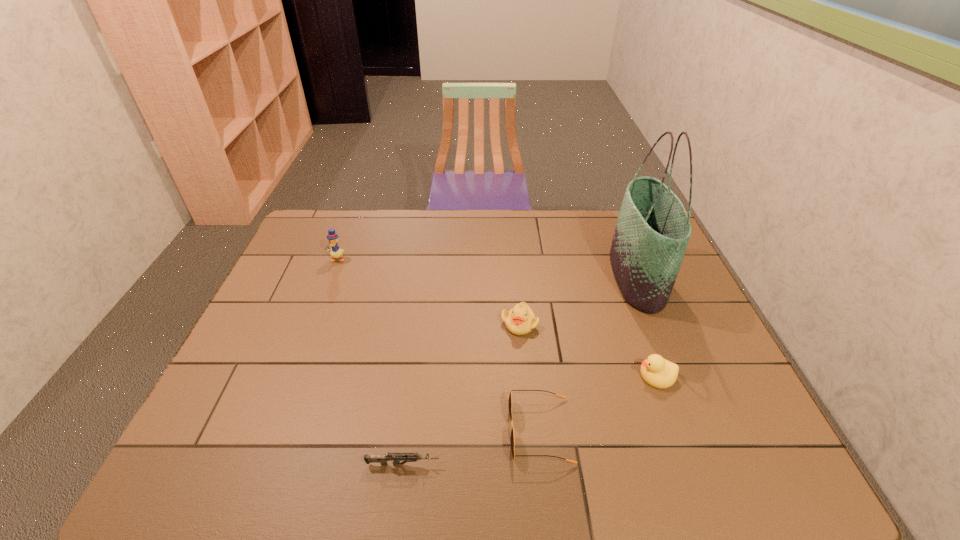
Image resolution: width=960 pixels, height=540 pixels. Find the location of `vacant region between the second duckling from right to left and the shortest object`. vacant region between the second duckling from right to left and the shortest object is located at coordinates (462, 394).

Locate which object ranks fifth in proximity to the rightmost duckling. Please provide its 2D coordinates. Your answer should be formatted as a tuple, i.e. [(x, y)], where the tuple contains the x and y coordinates of a point satisfying the conditions above.

[(335, 252)]

Identify which object is the fourth closest to the tote bag. Please provide its 2D coordinates. Your answer should be formatted as a tuple, i.e. [(x, y)], where the tuple contains the x and y coordinates of a point satisfying the conditions above.

[(395, 457)]

Choose which duckling is the second nearest neighbor to the leftmost duckling. Please provide its 2D coordinates. Your answer should be formatted as a tuple, i.e. [(x, y)], where the tuple contains the x and y coordinates of a point satisfying the conditions above.

[(656, 371)]

Locate which duckling is the closest to the tallest duckling. Please provide its 2D coordinates. Your answer should be formatted as a tuple, i.e. [(x, y)], where the tuple contains the x and y coordinates of a point satisfying the conditions above.

[(520, 320)]

At what (x,y) coordinates should I click in order to perform the action: click on free point that satisfies the following two spatial constraints: 1. on the front side of the tallest object; 2. on the front-facing side of the sunglasses. Please return your answer as a coordinate pair (x, y). The height and width of the screenshot is (540, 960). Looking at the image, I should click on (699, 430).

The image size is (960, 540). In order to click on free point that satisfies the following two spatial constraints: 1. on the face of the farthest duckling, where the monocle is placed; 2. on the right side of the tallest object in this screenshot , I will do (x=330, y=278).